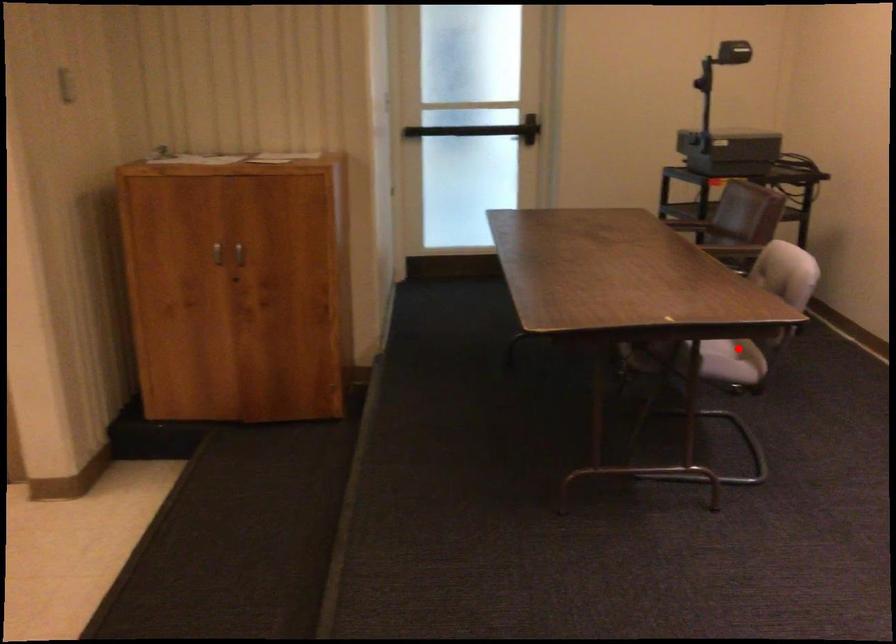
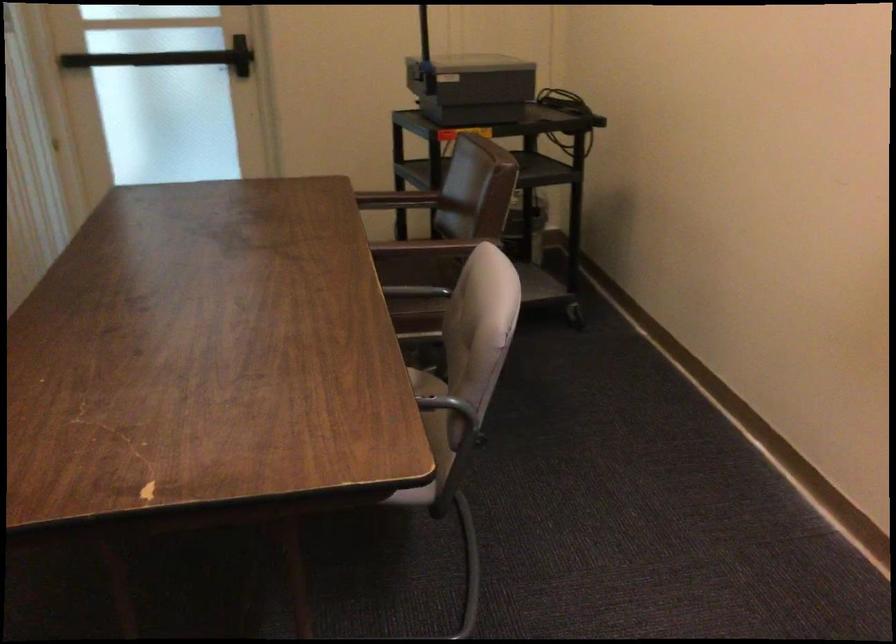
Question: I am providing you with two images of the same scene from different viewpoints. A red point is marked on the first image. Can you still see the location of the red point in image 2?

Choices:
 (A) Yes
 (B) No

Answer: (B)